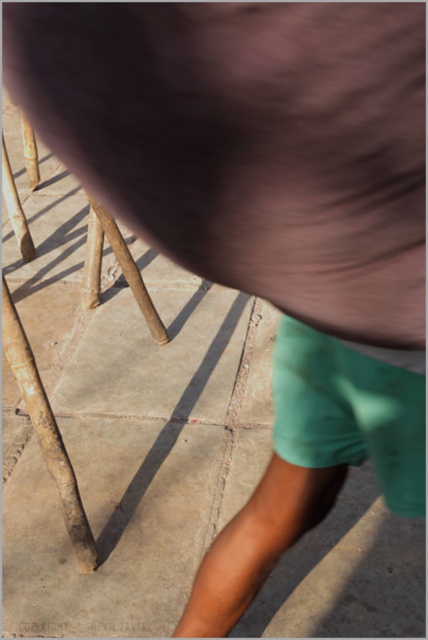
Question: Which of the following is the farthest from the observer?

Choices:
 (A) (47, 428)
 (B) (308, 403)

Answer: (A)

Question: Is green cotton shorts at lower right below brown wooden pole at lower left?

Choices:
 (A) yes
 (B) no

Answer: (B)

Question: Is green cotton shorts at lower right thinner than brown wooden pole at lower left?

Choices:
 (A) no
 (B) yes

Answer: (A)

Question: Does green cotton shorts at lower right have a smaller size compared to brown wooden pole at lower left?

Choices:
 (A) yes
 (B) no

Answer: (A)

Question: Which of the following is the closest to the observer?

Choices:
 (A) (26, 376)
 (B) (371, 394)

Answer: (B)